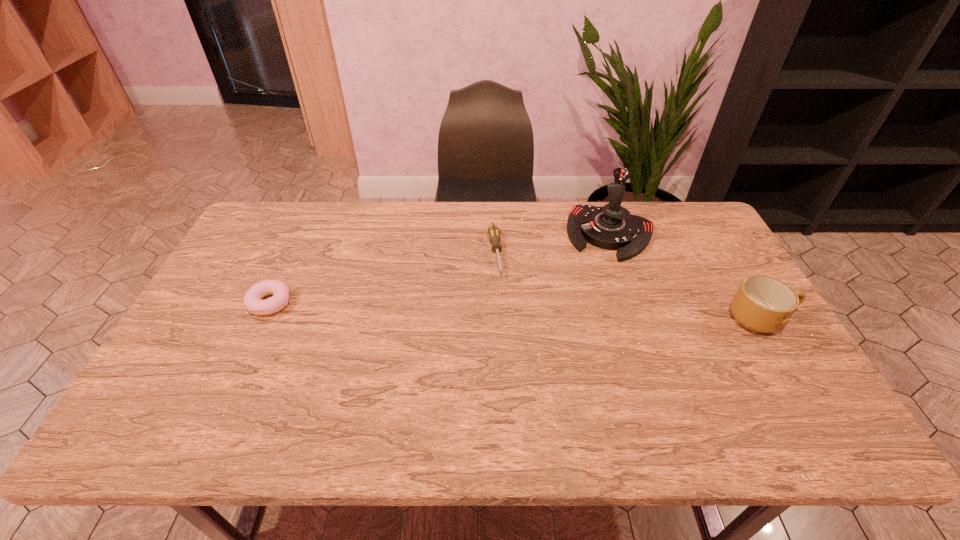
This screenshot has width=960, height=540. In order to click on free region located on the handle side of the second object from right to left in this screenshot , I will do `click(588, 301)`.

The image size is (960, 540). Find the location of `vacant space situated on the handle side of the second object from right to left`. vacant space situated on the handle side of the second object from right to left is located at coordinates (581, 323).

Image resolution: width=960 pixels, height=540 pixels. What are the coordinates of `vacant space situated on the handle side of the second object from right to left` in the screenshot? It's located at (580, 328).

The height and width of the screenshot is (540, 960). Find the location of `screwdriver that is at the far edge`. screwdriver that is at the far edge is located at coordinates (493, 232).

Locate an element on the screen. This screenshot has height=540, width=960. joystick at the far edge is located at coordinates (612, 227).

Locate an element on the screen. The image size is (960, 540). object situated at the left edge is located at coordinates (252, 299).

Where is `object that is at the right edge`? object that is at the right edge is located at coordinates (762, 304).

Find the location of `vacant space at the far edge`. vacant space at the far edge is located at coordinates (471, 206).

Identify the location of vacant space at the near edge. (349, 372).

In the image, there is a desktop. Where is `vacant space at the left edge`? vacant space at the left edge is located at coordinates tap(269, 256).